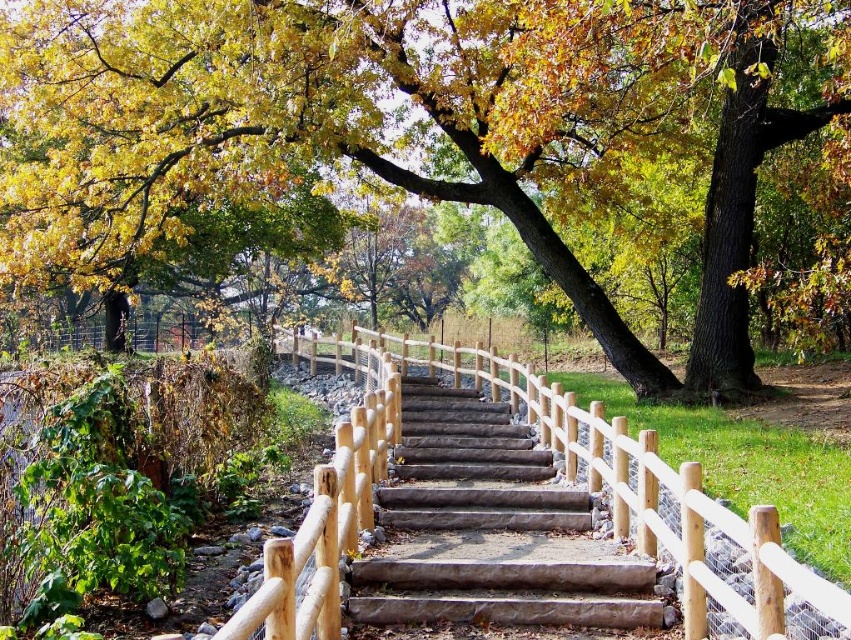
Based on the photo, you are standing at the bottom of the brown wood stairs at center and want to grab the natural wood rail at center for support. Can you reach it without moving your feet?

The natural wood rail at center is closer to the viewer than the brown wood stairs at center, so yes, you can reach it without moving your feet since it is nearer to you.

You are a painter standing at the bottom of the brown wood stairs at center, wanting to paint the natural wood rail at center. If your paintbrush can reach up to 5 meters, can you comfortably paint the rail without moving closer?

The distance between the natural wood rail at center and brown wood stairs at center is 6.21 meters, which is beyond the 5 meter reach of your paintbrush. Therefore, you cannot comfortably paint the rail without moving closer.

You are standing at the bottom of the brown wood stairs at center and want to reach the top. How does the natural wood rail at center help you in this task?

The natural wood rail at center is positioned over the brown wood stairs at center, so you can hold onto it for support while climbing the stairs.